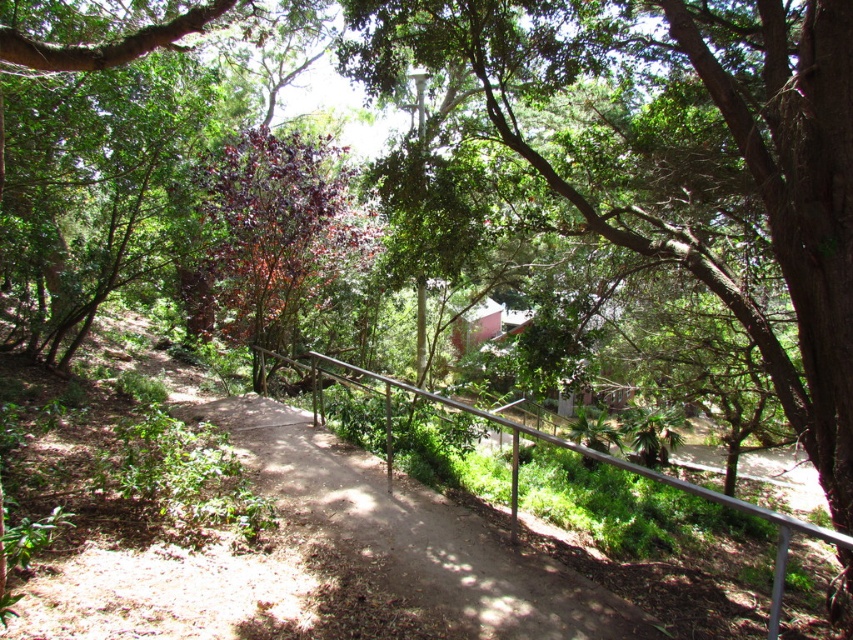
Can you confirm if purple-leaved tree at center is positioned above silver metallic railing at center?

Yes, purple-leaved tree at center is above silver metallic railing at center.

Between purple-leaved tree at center and silver metallic railing at center, which one appears on the left side from the viewer's perspective?

Positioned to the left is purple-leaved tree at center.

The width and height of the screenshot is (853, 640). What do you see at coordinates (271, 236) in the screenshot?
I see `purple-leaved tree at center` at bounding box center [271, 236].

Identify the location of purple-leaved tree at center. This screenshot has width=853, height=640. (271, 236).